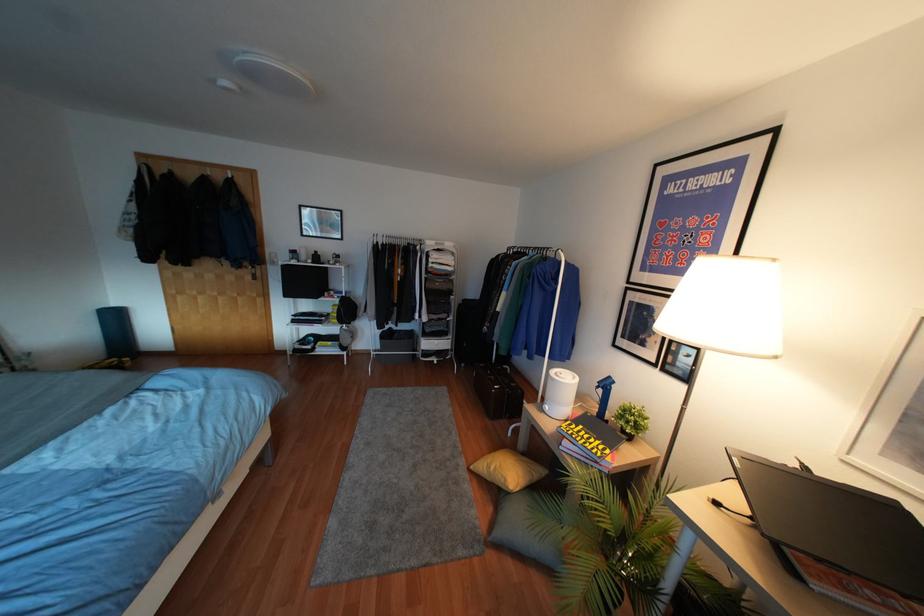
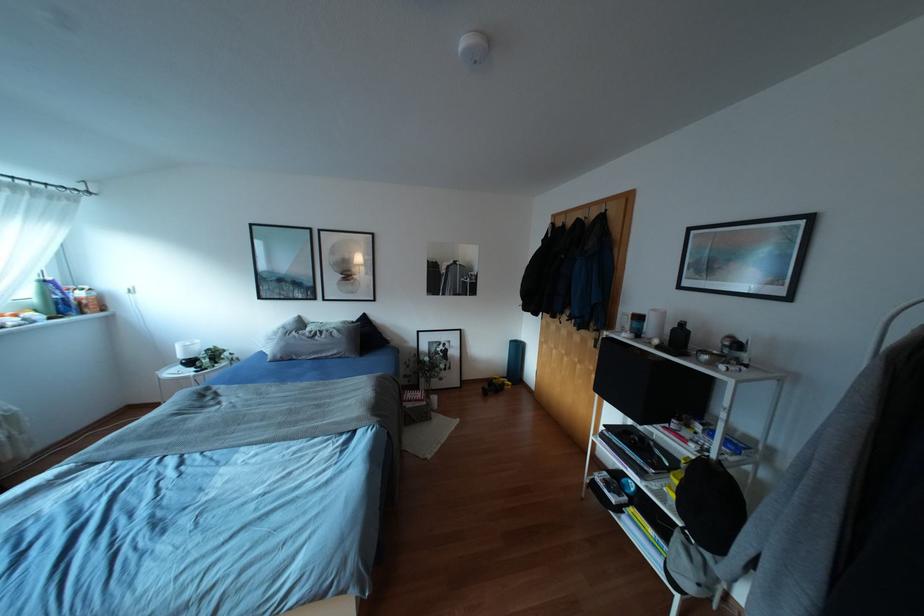
Find the pixel in the second image that matches point 238,180 in the first image.

(612, 214)